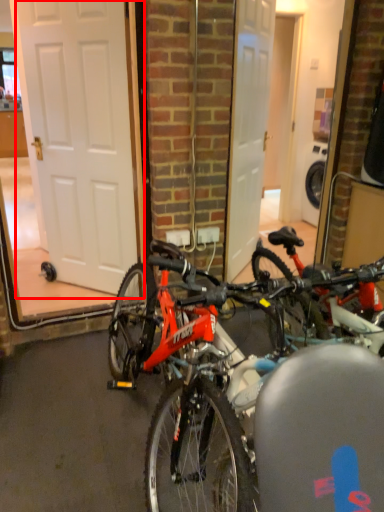
Question: From the image's perspective, where is door (annotated by the red box) located relative to bicycle?

Choices:
 (A) below
 (B) above

Answer: (B)